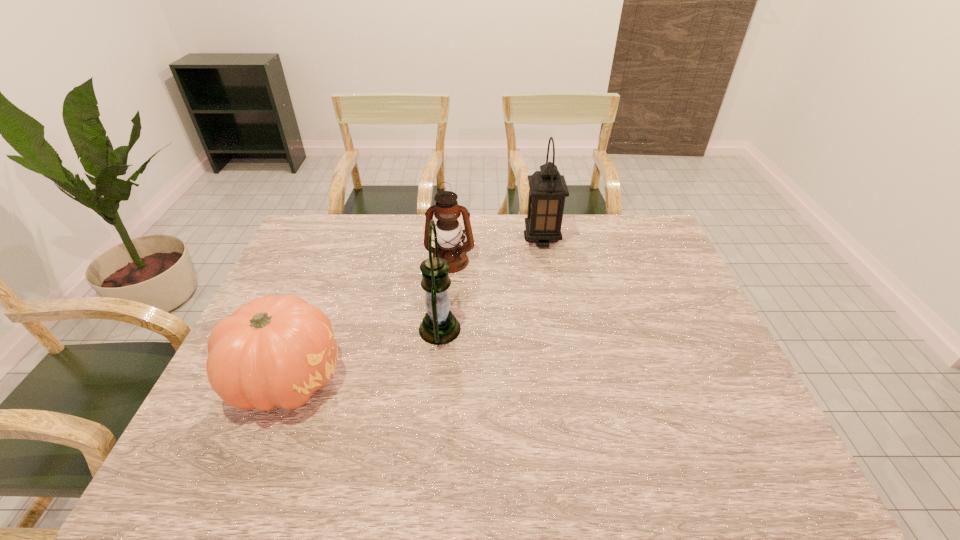
This screenshot has width=960, height=540. Find the location of `blank region between the second shortest object and the pumpkin`. blank region between the second shortest object and the pumpkin is located at coordinates (369, 320).

Locate an element on the screen. The image size is (960, 540). unoccupied position between the rightmost lantern and the second shortest object is located at coordinates (496, 250).

Locate an element on the screen. The height and width of the screenshot is (540, 960). free space that is in between the leftmost object and the nearest lantern is located at coordinates (364, 354).

Find the location of a particular element. The width and height of the screenshot is (960, 540). vacant point located between the leftmost object and the rightmost object is located at coordinates (415, 309).

What are the coordinates of `the second closest object to the rightmost object` in the screenshot? It's located at (439, 326).

Where is `object that is the second closest one to the nearest lantern`? Image resolution: width=960 pixels, height=540 pixels. object that is the second closest one to the nearest lantern is located at coordinates (274, 351).

Where is `lantern that is the closest to the shortest object`? lantern that is the closest to the shortest object is located at coordinates (x=439, y=326).

Choose which lantern is the second nearest neighbor to the nearest lantern. Please provide its 2D coordinates. Your answer should be formatted as a tuple, i.e. [(x, y)], where the tuple contains the x and y coordinates of a point satisfying the conditions above.

[(547, 188)]

The height and width of the screenshot is (540, 960). What are the coordinates of `free space that satisfies the following two spatial constraints: 1. on the side of the shortest lantern, there is a wick adjustment knob; 2. on the carved face of the shortest object` in the screenshot? It's located at (441, 379).

At what (x,y) coordinates should I click in order to perform the action: click on vacant space that satisfies the following two spatial constraints: 1. on the side of the shortest lantern, there is a wick adjustment knob; 2. on the carved face of the leftmost object. Please return your answer as a coordinate pair (x, y). The width and height of the screenshot is (960, 540). Looking at the image, I should click on (441, 379).